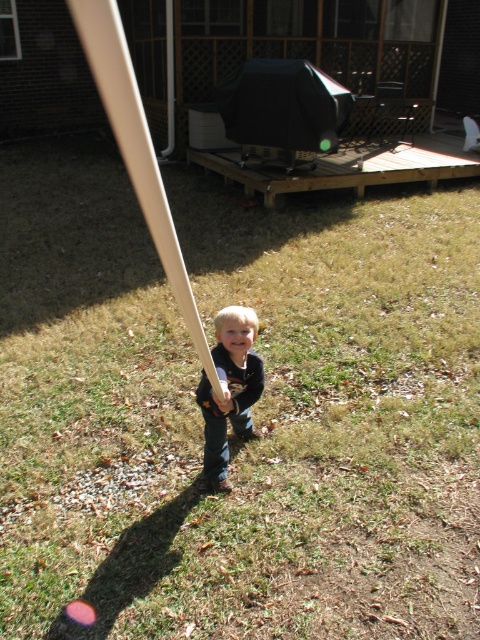
Question: Which point appears closest to the camera in this image?

Choices:
 (A) click(x=252, y=314)
 (B) click(x=165, y=196)

Answer: (B)

Question: Can you confirm if white matte baseball bat at center is positioned to the right of smooth brown bat at center?

Choices:
 (A) yes
 (B) no

Answer: (B)

Question: Which of the following is the farthest from the observer?

Choices:
 (A) white matte baseball bat at center
 (B) smooth brown bat at center

Answer: (B)

Question: Is the position of white matte baseball bat at center less distant than that of smooth brown bat at center?

Choices:
 (A) yes
 (B) no

Answer: (A)

Question: Which point is closer to the camera taking this photo?

Choices:
 (A) (207, 432)
 (B) (135, 164)

Answer: (B)

Question: Can you confirm if white matte baseball bat at center is positioned above smooth brown bat at center?

Choices:
 (A) yes
 (B) no

Answer: (A)